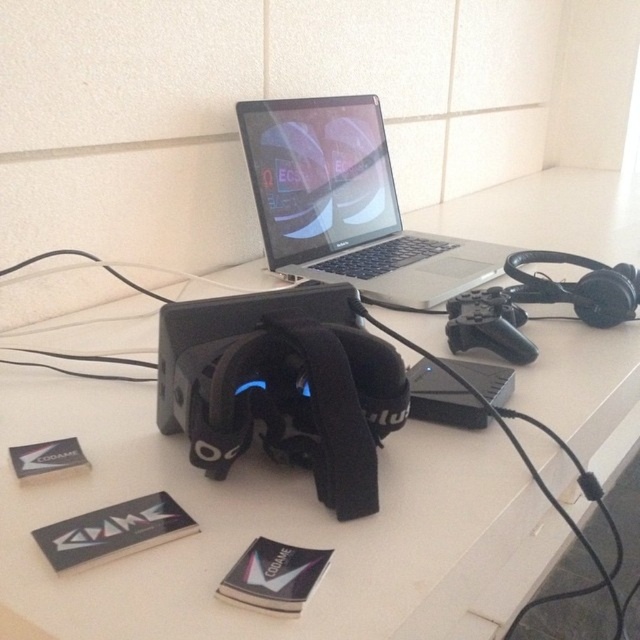
Does white matte computer desk at center have a lesser width compared to silver metallic laptop at center?

Incorrect, white matte computer desk at center's width is not less than silver metallic laptop at center's.

Which of these two, white matte computer desk at center or silver metallic laptop at center, stands shorter?

With less height is silver metallic laptop at center.

Find the location of a particular element. white matte computer desk at center is located at coordinates (268, 531).